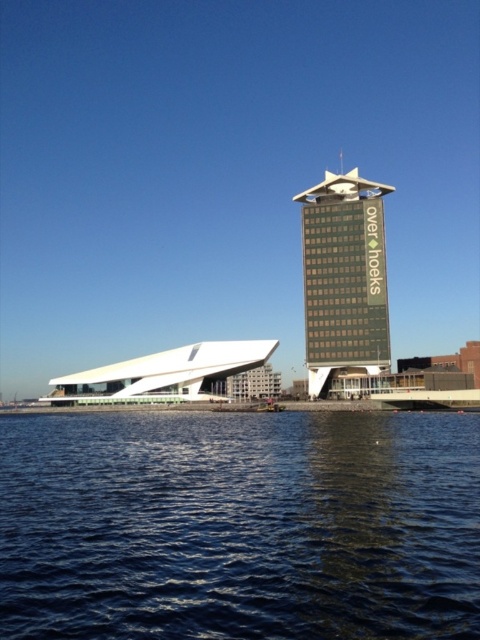
Who is positioned more to the right, dark blue water at lower center or green glass building at center?

Positioned to the right is green glass building at center.

Which is below, dark blue water at lower center or green glass building at center?

Positioned lower is dark blue water at lower center.

Image resolution: width=480 pixels, height=640 pixels. Describe the element at coordinates (240, 525) in the screenshot. I see `dark blue water at lower center` at that location.

This screenshot has width=480, height=640. Find the location of `dark blue water at lower center`. dark blue water at lower center is located at coordinates (240, 525).